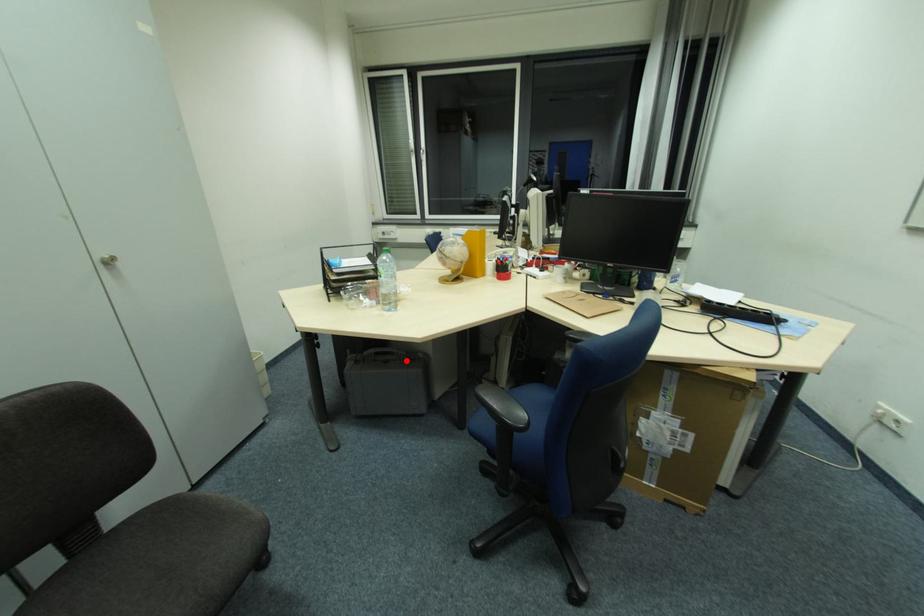
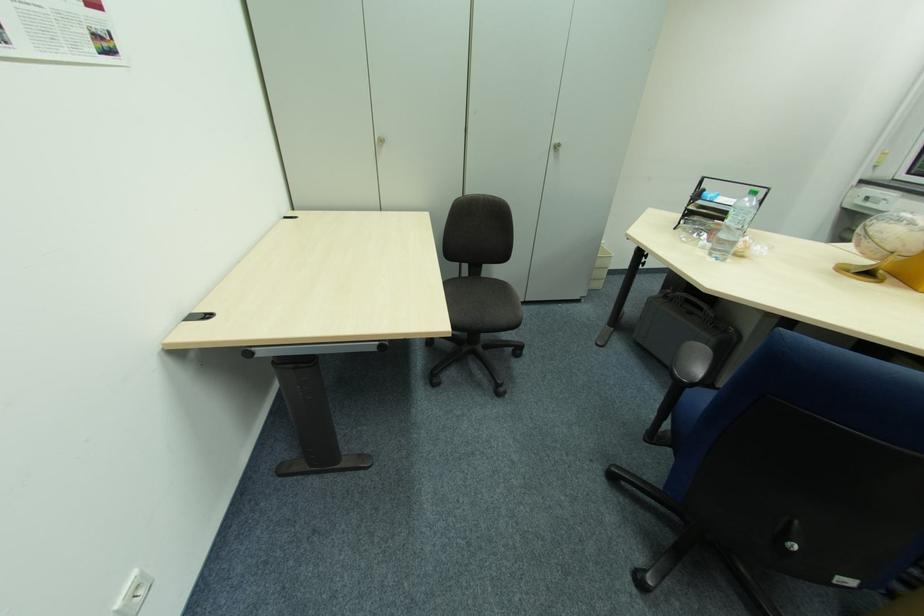
Where in the second image is the point corresponding to the highlighted location from the first image?

(711, 323)